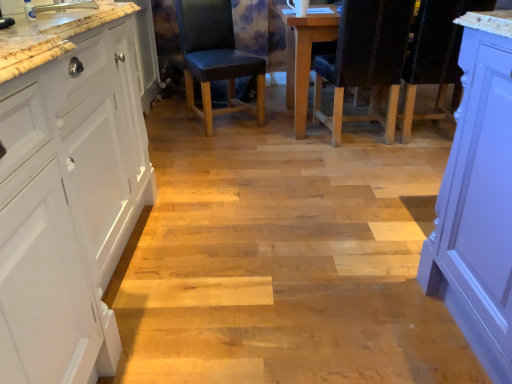
Question: In which direction should I rotate to look at black leather chair at center, positioned as the second chair in left-to-right order?

Choices:
 (A) right
 (B) left

Answer: (A)

Question: From the image's perspective, does black leather chair at center, arranged as the first chair when viewed from the right, appear higher than white matte cabinet at left?

Choices:
 (A) no
 (B) yes

Answer: (B)

Question: Is black leather chair at center, arranged as the first chair when viewed from the right, bigger than white matte cabinet at left?

Choices:
 (A) yes
 (B) no

Answer: (B)

Question: Is black leather chair at center, positioned as the second chair in left-to-right order, positioned beyond the bounds of white matte cabinet at left?

Choices:
 (A) yes
 (B) no

Answer: (A)

Question: Considering the relative sizes of black leather chair at center, positioned as the second chair in left-to-right order, and white matte cabinet at left in the image provided, is black leather chair at center, positioned as the second chair in left-to-right order, smaller than white matte cabinet at left?

Choices:
 (A) no
 (B) yes

Answer: (B)

Question: Can you confirm if black leather chair at center, positioned as the second chair in left-to-right order, is shorter than white matte cabinet at left?

Choices:
 (A) yes
 (B) no

Answer: (A)

Question: Can you confirm if black leather chair at center, arranged as the first chair when viewed from the right, is positioned to the left of white matte cabinet at left?

Choices:
 (A) no
 (B) yes

Answer: (A)

Question: From the image's perspective, is white matte cabinet at left on top of black leather chair at center, arranged as the first chair when viewed from the right?

Choices:
 (A) yes
 (B) no

Answer: (B)

Question: From a real-world perspective, is white matte cabinet at left located higher than black leather chair at center, positioned as the second chair in left-to-right order?

Choices:
 (A) no
 (B) yes

Answer: (B)

Question: Does white matte cabinet at left have a lesser height compared to black leather chair at center, arranged as the first chair when viewed from the right?

Choices:
 (A) yes
 (B) no

Answer: (B)

Question: Would you say white matte cabinet at left contains black leather chair at center, arranged as the first chair when viewed from the right?

Choices:
 (A) yes
 (B) no

Answer: (B)

Question: Does white matte cabinet at left lie in front of black leather chair at center, arranged as the first chair when viewed from the right?

Choices:
 (A) yes
 (B) no

Answer: (A)

Question: From a real-world perspective, is white matte cabinet at left below black leather chair at center, arranged as the first chair when viewed from the right?

Choices:
 (A) yes
 (B) no

Answer: (B)

Question: Is the position of leather-like black chair at center, arranged as the 1th chair when viewed from the left, more distant than that of black leather chair at center, positioned as the second chair in left-to-right order?

Choices:
 (A) yes
 (B) no

Answer: (A)